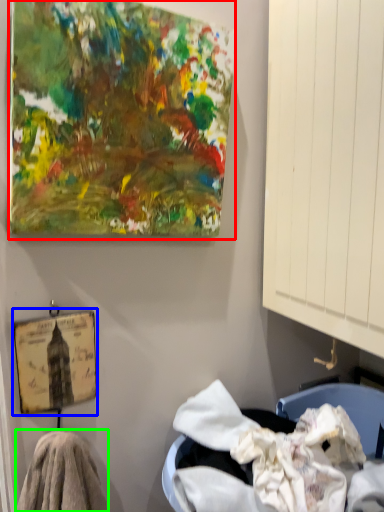
Question: Based on their relative distances, which object is nearer to oil painting (highlighted by a red box)? Choose from picture frame (highlighted by a blue box) and material (highlighted by a green box).

Choices:
 (A) picture frame
 (B) material

Answer: (A)